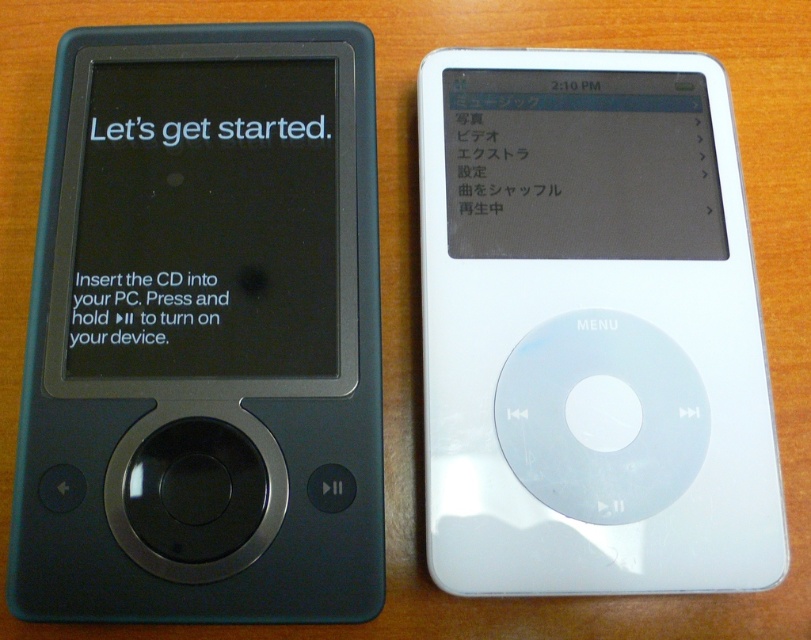
You are setting up a display for a tech exhibition and have two items to place on a shelf. You have a matte black ipod at left and a matte black screen at left. Given that the shelf has limited space, which item should you choose to maximize the shelf space available for other items?

The matte black screen at left is smaller in width compared to the matte black ipod at left, so choosing the matte black screen at left would free up more space on the shelf for other items.

You are looking at two iPods placed on a wooden surface. You see a point at position (325, 173) and another point at (217, 168). Which point is closer to you?

Point (325, 173) is further to the viewer than point (217, 168), so the point at (217, 168) is closer to you.

You are trying to locate the matte black ipod at left in the image. What are the coordinates where it is positioned?

The matte black ipod at left is positioned at coordinates point (204,326).